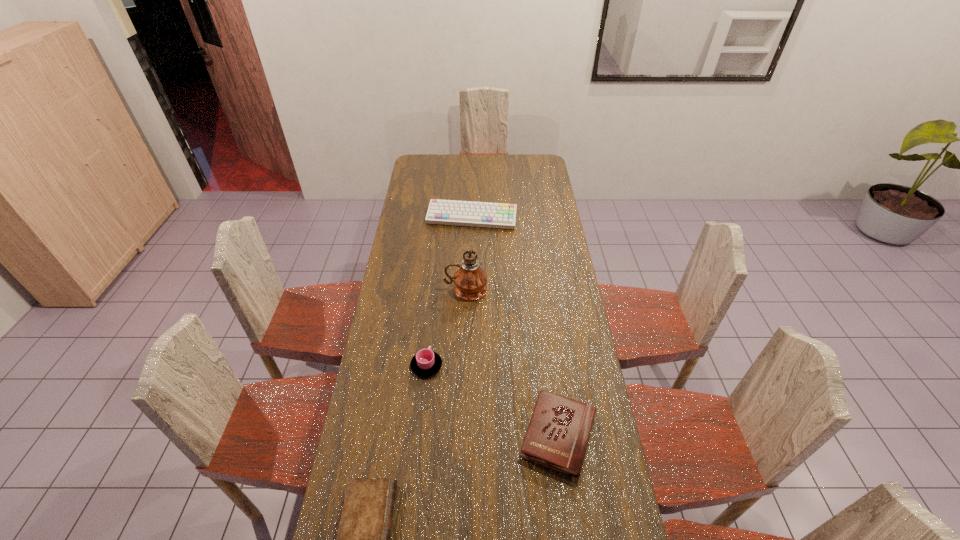
The image size is (960, 540). Find the location of `blank space located 0.400m on the left of the second nearest object`. blank space located 0.400m on the left of the second nearest object is located at coordinates (392, 435).

Image resolution: width=960 pixels, height=540 pixels. What are the coordinates of `computer keyboard at the left edge` in the screenshot? It's located at coord(445,212).

Locate an element on the screen. cup at the left edge is located at coordinates (425, 363).

You are a GUI agent. You are given a task and a screenshot of the screen. Output one action in this format:
    pyautogui.click(x=<x>, y=<y>)
    Task: Click on the object that is at the right edge
    The width and height of the screenshot is (960, 540).
    Given the screenshot: What is the action you would take?
    pyautogui.click(x=557, y=437)

Where is `vacant space at the far edge of the desktop`? This screenshot has height=540, width=960. vacant space at the far edge of the desktop is located at coordinates (511, 176).

Locate an element on the screen. This screenshot has width=960, height=540. blank space at the left edge of the desktop is located at coordinates (399, 288).

You are a GUI agent. You are given a task and a screenshot of the screen. Output one action in this format:
    pyautogui.click(x=<x>, y=<y>)
    Task: Click on the free space at the right edge of the desktop
    
    Given the screenshot: What is the action you would take?
    pyautogui.click(x=552, y=187)

The height and width of the screenshot is (540, 960). Identify the location of vacant space at the far left corner of the desktop. (438, 171).

You are a GUI agent. You are given a task and a screenshot of the screen. Output one action in this format:
    pyautogui.click(x=<x>, y=<y>)
    Task: Click on the empty space that is in between the computer keyboard and the hardback book
    This screenshot has width=960, height=540.
    Given the screenshot: What is the action you would take?
    pyautogui.click(x=516, y=327)

Find the location of a particular element. The height and width of the screenshot is (540, 960). vacant space that's between the computer keyboard and the third farthest object is located at coordinates (449, 292).